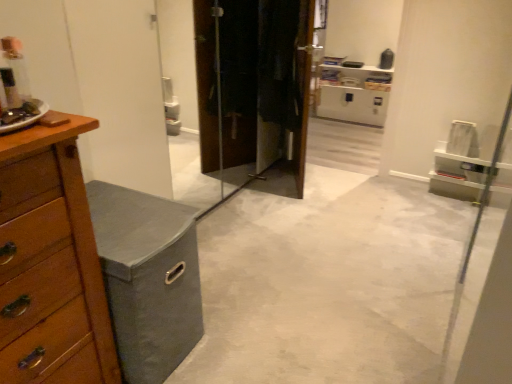
Where is `vacant area that lies to the right of wooden vanity at left`? The image size is (512, 384). vacant area that lies to the right of wooden vanity at left is located at coordinates (242, 324).